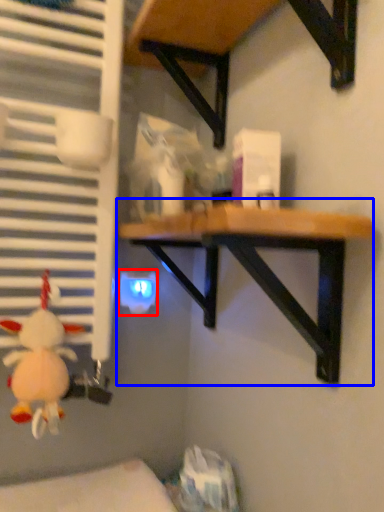
Question: Which object appears farthest to the camera in this image, electric outlet (highlighted by a red box) or table (highlighted by a blue box)?

Choices:
 (A) electric outlet
 (B) table

Answer: (A)